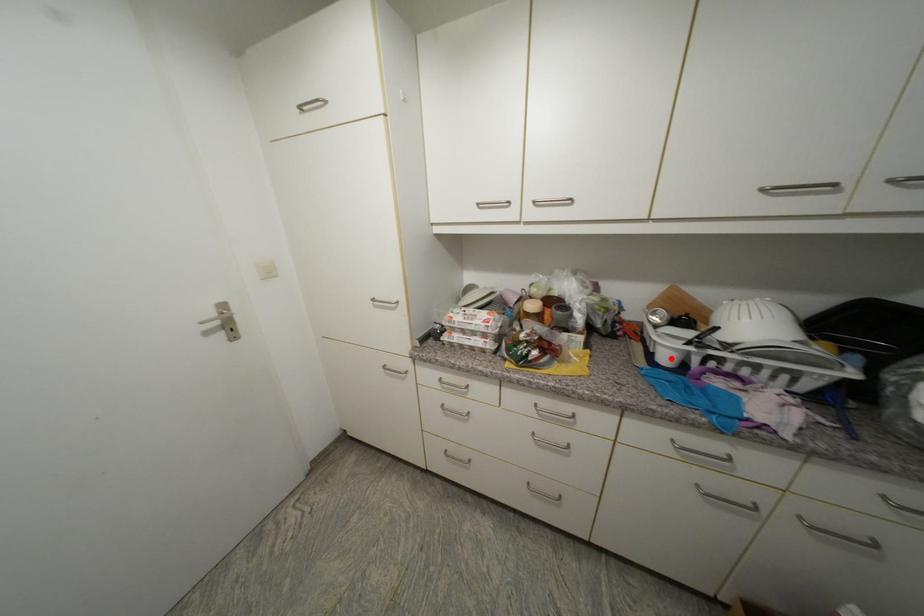
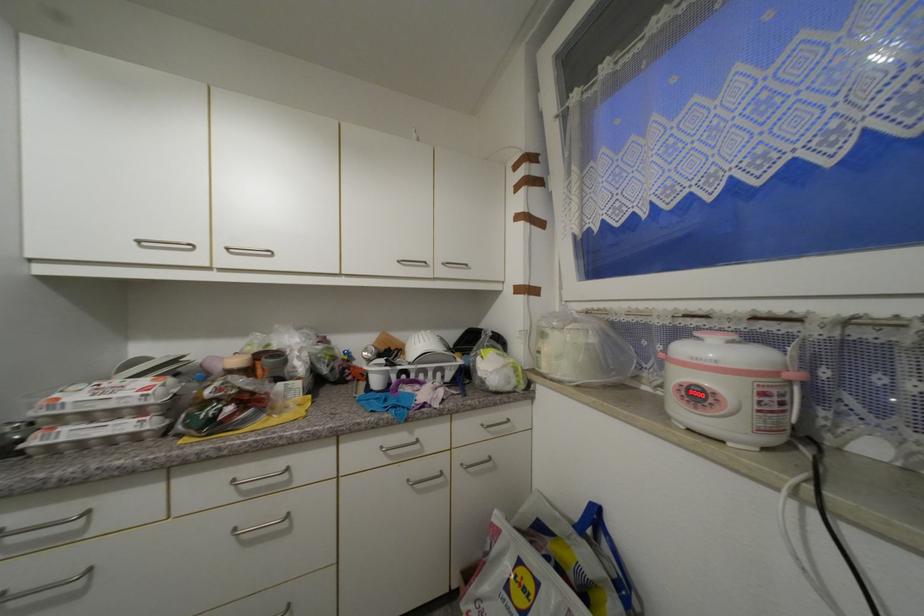
Question: I am providing you with two images of the same scene from different viewpoints. In image1, a red point is highlighted. Considering the same 3D point in image2, which of the following is correct?

Choices:
 (A) It is closer
 (B) It is farther

Answer: (B)